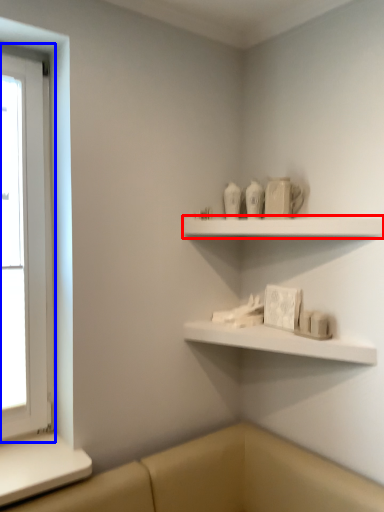
Question: Which object is closer to the camera taking this photo, shelf (highlighted by a red box) or window (highlighted by a blue box)?

Choices:
 (A) shelf
 (B) window

Answer: (A)